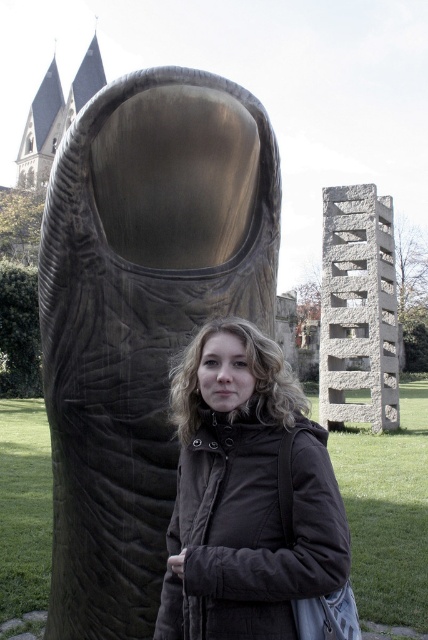
You are a photographer planning to take a photo of the bronze textured sculpture at center and the dark brown quilted jacket at center. You want to ensure both are fully visible in the frame. Given that the sculpture is wider than the jacket, which object requires a wider angle lens to capture its full width?

The bronze textured sculpture at center requires a wider angle lens because its width is larger than the dark brown quilted jacket at center, necessitating a wider field of view to capture its full size.

You are a photographer trying to capture both the bronze textured sculpture at center and the dark brown quilted jacket at center in a single frame. Given that the sculpture is larger, how should you position yourself relative to them to ensure both are clearly visible in the photo?

Since the bronze textured sculpture at center is larger than the dark brown quilted jacket at center, you should position yourself farther away from them to include the entire sculpture while still keeping the jacket in the frame.

You are a photographer trying to capture both the bronze textured sculpture at center and the dark brown quilted jacket at center in a single shot. Which object should you focus on first to ensure both are in frame?

You should focus on the bronze textured sculpture at center first because it is closer to you than the dark brown quilted jacket at center, so adjusting the camera to include it will naturally include the jacket in the background.